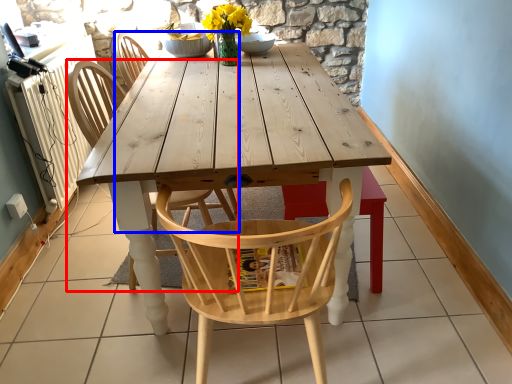
Question: Among these objects, which one is nearest to the camera, chair (highlighted by a red box) or chair (highlighted by a blue box)?

Choices:
 (A) chair
 (B) chair

Answer: (A)